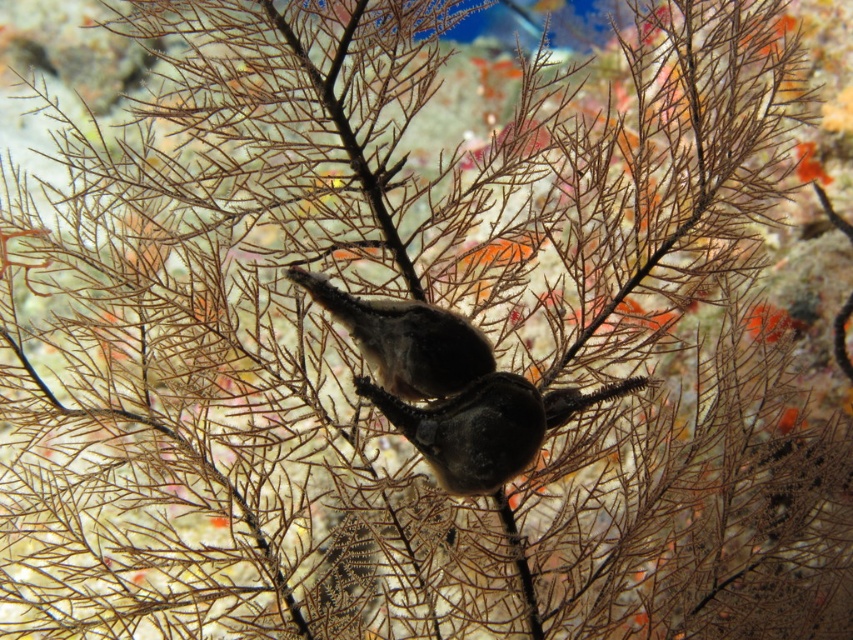
Question: Is smooth dark gray seahorse at center positioned behind brown textured bird at center?

Choices:
 (A) no
 (B) yes

Answer: (A)

Question: Is smooth dark gray seahorse at center above brown textured bird at center?

Choices:
 (A) yes
 (B) no

Answer: (B)

Question: Observing the image, what is the correct spatial positioning of smooth dark gray seahorse at center in reference to brown textured bird at center?

Choices:
 (A) left
 (B) right

Answer: (B)

Question: Which object is closer to the camera taking this photo?

Choices:
 (A) smooth dark gray seahorse at center
 (B) brown textured bird at center

Answer: (A)

Question: Which point is farther from the camera taking this photo?

Choices:
 (A) (425, 310)
 (B) (526, 429)

Answer: (B)

Question: Among these objects, which one is nearest to the camera?

Choices:
 (A) brown textured bird at center
 (B) smooth dark gray seahorse at center

Answer: (B)